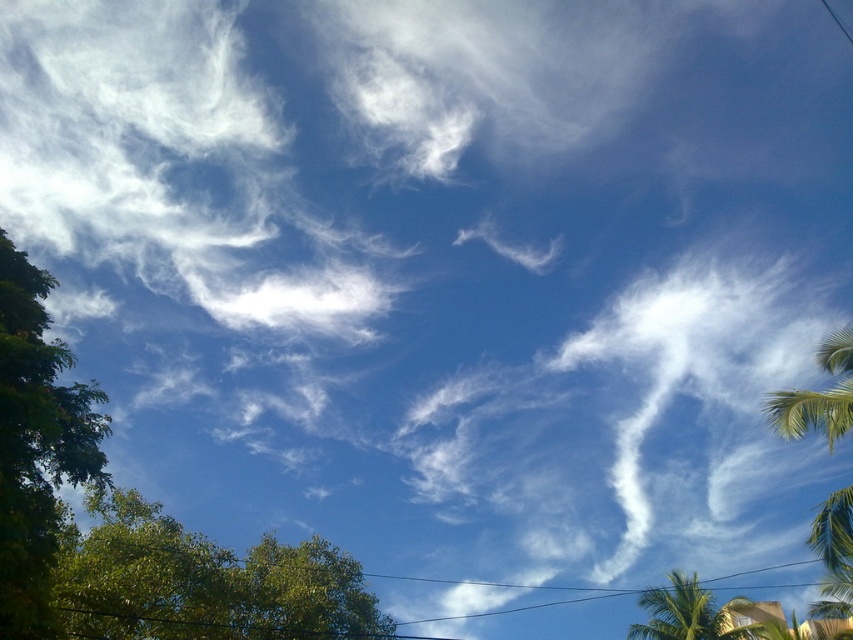
Question: Can you confirm if green leafy palm tree at right is wider than green leafy palm tree at lower right?

Choices:
 (A) no
 (B) yes

Answer: (B)

Question: Which of these objects is positioned farthest from the green leafy palm tree at lower right?

Choices:
 (A) green leafy tree at lower left
 (B) green leafy tree at left

Answer: (B)

Question: Where is green leafy palm tree at right located in relation to green leafy palm tree at lower right in the image?

Choices:
 (A) left
 (B) right

Answer: (B)

Question: Estimate the real-world distances between objects in this image. Which object is closer to the green leafy tree at lower left?

Choices:
 (A) green leafy palm tree at right
 (B) green leafy palm tree at lower right
 (C) green leafy tree at left

Answer: (C)

Question: Does green leafy tree at lower left appear over green leafy palm tree at lower right?

Choices:
 (A) no
 (B) yes

Answer: (B)

Question: Among these objects, which one is nearest to the camera?

Choices:
 (A) green leafy palm tree at right
 (B) green leafy tree at lower left
 (C) green leafy palm tree at lower right
 (D) green leafy tree at left

Answer: (D)